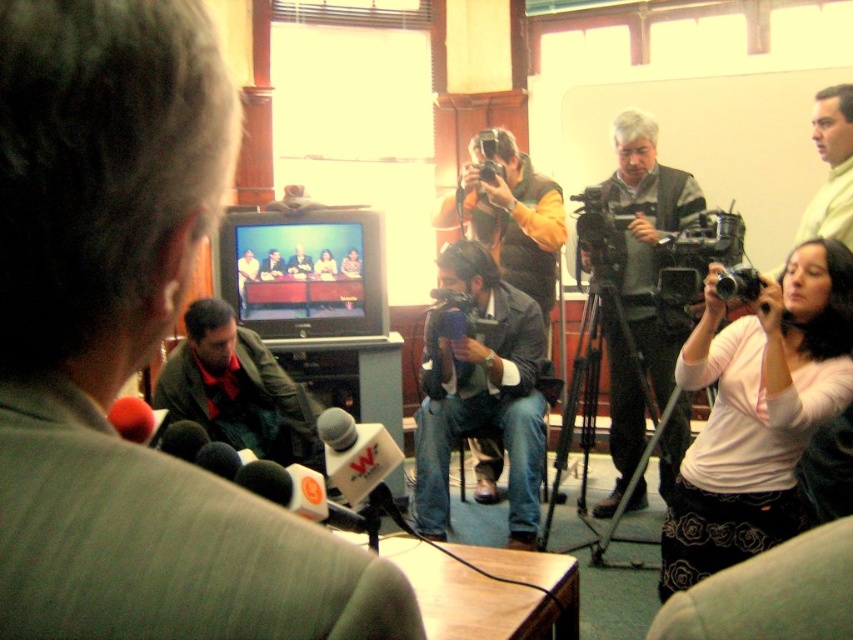
Question: Which object appears farthest from the camera in this image?

Choices:
 (A) gray vest at center
 (B) orange fabric camera at center
 (C) green matte jacket at center

Answer: (B)

Question: Which object is closer to the camera taking this photo?

Choices:
 (A) green matte jacket at center
 (B) metallic silver camera at center

Answer: (B)

Question: Can you confirm if gray vest at center is positioned above black plastic camera at center?

Choices:
 (A) yes
 (B) no

Answer: (B)

Question: Which object appears closest to the camera in this image?

Choices:
 (A) metallic silver camera at center
 (B) pink fabric shirt at upper right

Answer: (B)

Question: Is orange fabric camera at center wider than green matte shirt at upper right?

Choices:
 (A) no
 (B) yes

Answer: (B)

Question: Is green fabric jacket at left further to camera compared to pink fabric shirt at upper right?

Choices:
 (A) yes
 (B) no

Answer: (B)